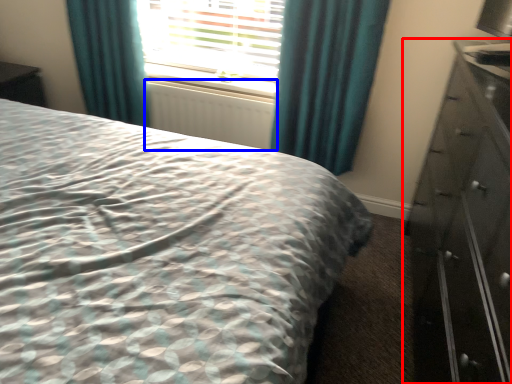
Question: Which of the following is the closest to the observer, chest of drawers (highlighted by a red box) or radiator (highlighted by a blue box)?

Choices:
 (A) chest of drawers
 (B) radiator

Answer: (A)